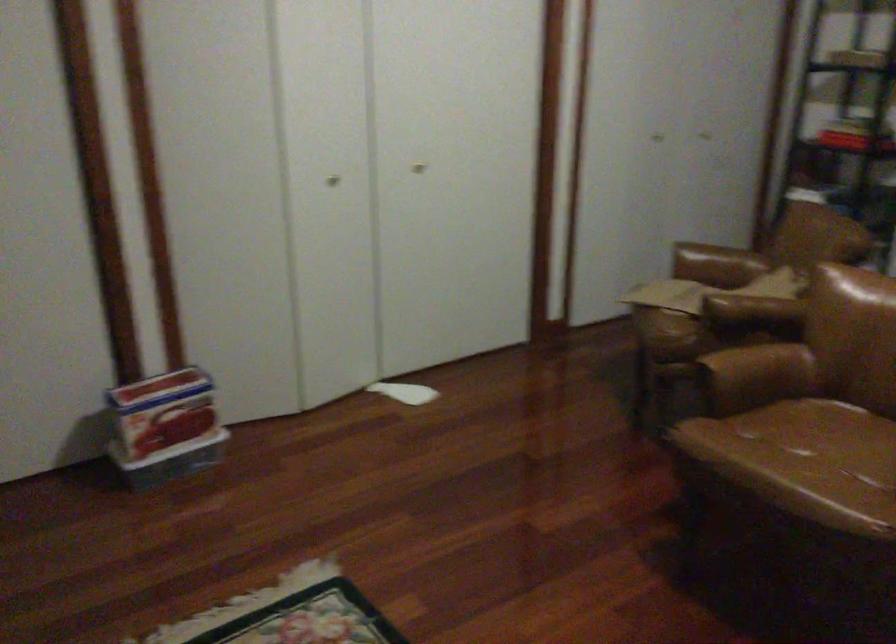
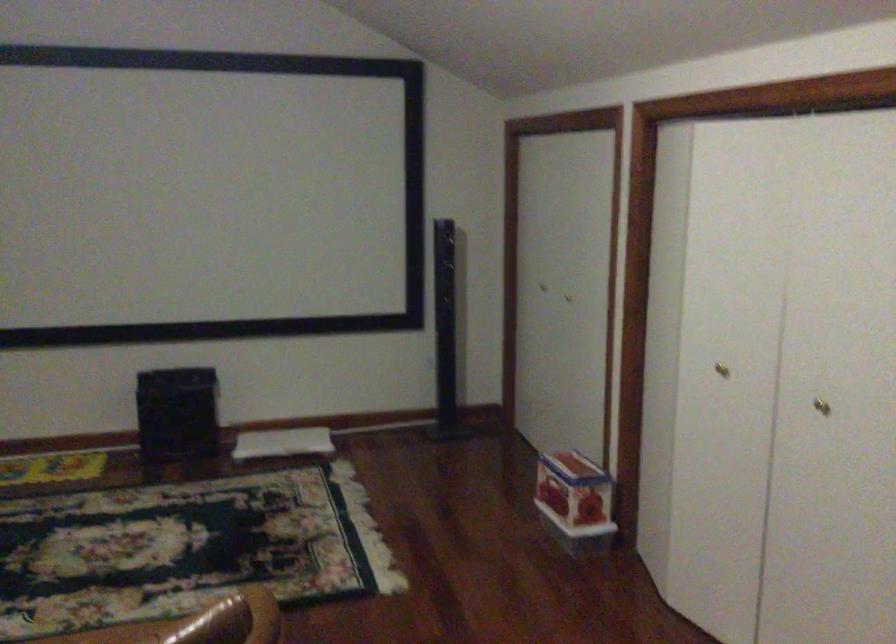
Find the pixel in the second image that matches (328,173) in the first image.

(721, 368)